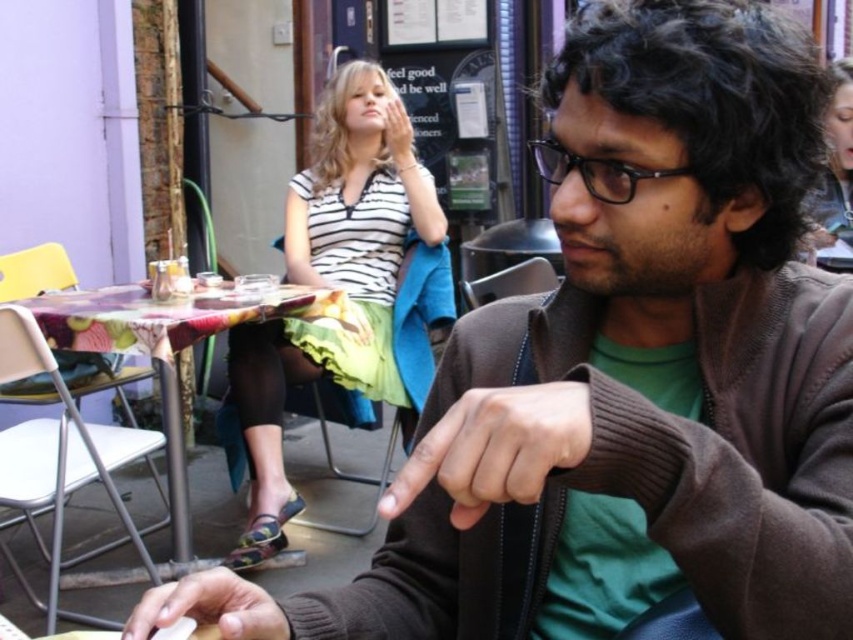
Between white striped shirt at upper center and printed fabric table at center, which one has less height?

printed fabric table at center

Is point (343, 176) farther from camera compared to point (315, 294)?

That is True.

Where is `white striped shirt at upper center`? white striped shirt at upper center is located at coordinates (332, 284).